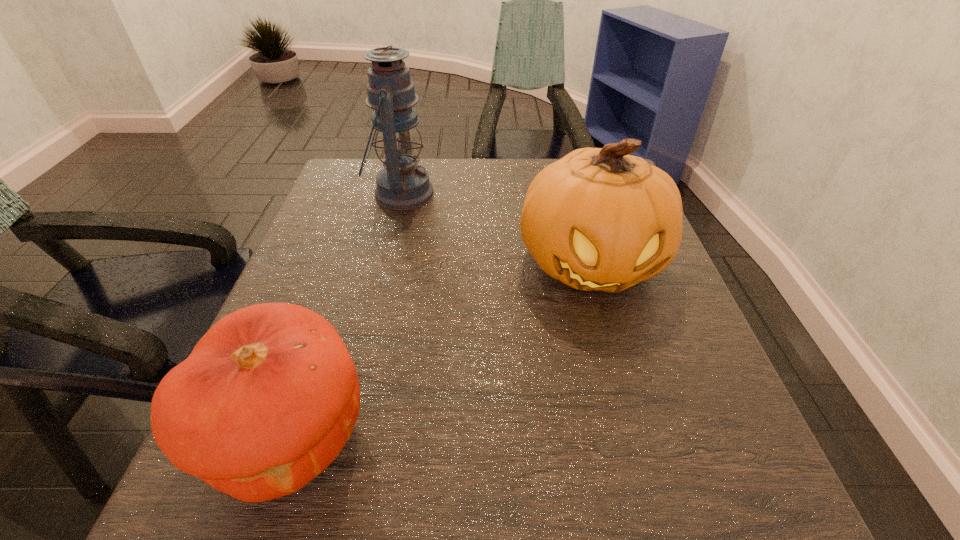
Where is `object at the near edge`? object at the near edge is located at coordinates (269, 396).

Locate an element on the screen. The height and width of the screenshot is (540, 960). lantern located at the left edge is located at coordinates (402, 185).

This screenshot has height=540, width=960. What are the coordinates of `pumpkin present at the left edge` in the screenshot? It's located at pyautogui.click(x=269, y=396).

The image size is (960, 540). I want to click on object present at the right edge, so pos(598,219).

Find the location of a particular element. object located in the far left corner section of the desktop is located at coordinates (402, 185).

Locate an element on the screen. This screenshot has height=540, width=960. object that is at the near left corner is located at coordinates (269, 396).

Find the location of a particular element. The image size is (960, 540). vacant space at the near edge of the desktop is located at coordinates (342, 493).

Find the location of `free spot at the left edge of the desktop`. free spot at the left edge of the desktop is located at coordinates pyautogui.click(x=348, y=217).

At what (x,y) coordinates should I click in order to perform the action: click on free space at the right edge of the desktop. Please return your answer as a coordinate pair (x, y). The image size is (960, 540). Looking at the image, I should click on (656, 320).

At what (x,y) coordinates should I click in order to perform the action: click on vacant space at the far left corner of the desktop. Please return your answer as a coordinate pair (x, y). This screenshot has height=540, width=960. Looking at the image, I should click on (366, 193).